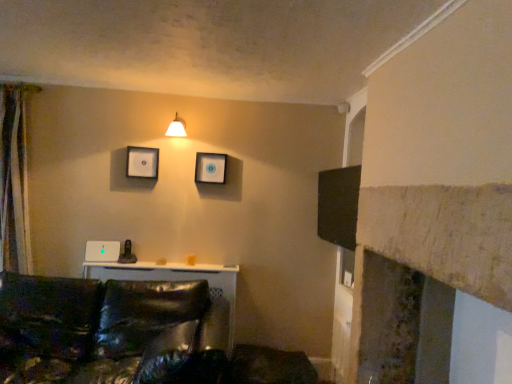
Question: Considering the relative positions of matte white picture frame at upper center, the 2th picture frame from the right, and silky beige curtain at left in the image provided, is matte white picture frame at upper center, the 2th picture frame from the right, to the right of silky beige curtain at left from the viewer's perspective?

Choices:
 (A) no
 (B) yes

Answer: (B)

Question: From the image's perspective, is matte white picture frame at upper center, the first picture frame positioned from the left, located above silky beige curtain at left?

Choices:
 (A) no
 (B) yes

Answer: (B)

Question: Is matte white picture frame at upper center, the 2th picture frame from the right, positioned behind silky beige curtain at left?

Choices:
 (A) no
 (B) yes

Answer: (B)

Question: From a real-world perspective, is matte white picture frame at upper center, the first picture frame positioned from the left, located higher than silky beige curtain at left?

Choices:
 (A) no
 (B) yes

Answer: (B)

Question: Can we say matte white picture frame at upper center, the first picture frame positioned from the left, lies outside silky beige curtain at left?

Choices:
 (A) yes
 (B) no

Answer: (A)

Question: Is matte plastic picture frame at upper center, placed as the 1th picture frame when sorted from right to left, taller or shorter than shiny black leather couch at lower left?

Choices:
 (A) short
 (B) tall

Answer: (A)

Question: Is matte plastic picture frame at upper center, which appears as the second picture frame when viewed from the left, situated inside shiny black leather couch at lower left or outside?

Choices:
 (A) outside
 (B) inside

Answer: (A)

Question: Is matte plastic picture frame at upper center, placed as the 1th picture frame when sorted from right to left, in front of or behind shiny black leather couch at lower left in the image?

Choices:
 (A) front
 (B) behind

Answer: (B)

Question: Is point (220, 160) closer or farther from the camera than point (160, 344)?

Choices:
 (A) farther
 (B) closer

Answer: (A)

Question: From the image's perspective, is matte white wall sconce at upper center located above or below shiny black leather couch at lower left?

Choices:
 (A) above
 (B) below

Answer: (A)

Question: Considering their positions, is matte white wall sconce at upper center located in front of or behind shiny black leather couch at lower left?

Choices:
 (A) behind
 (B) front

Answer: (A)

Question: From their relative heights in the image, would you say matte white wall sconce at upper center is taller or shorter than shiny black leather couch at lower left?

Choices:
 (A) tall
 (B) short

Answer: (B)

Question: Is matte white wall sconce at upper center situated inside shiny black leather couch at lower left or outside?

Choices:
 (A) outside
 (B) inside

Answer: (A)

Question: From the image's perspective, relative to silky beige curtain at left, is matte plastic picture frame at upper center, which appears as the second picture frame when viewed from the left, above or below?

Choices:
 (A) below
 (B) above

Answer: (B)

Question: Would you say matte plastic picture frame at upper center, which appears as the second picture frame when viewed from the left, is inside or outside silky beige curtain at left?

Choices:
 (A) outside
 (B) inside

Answer: (A)